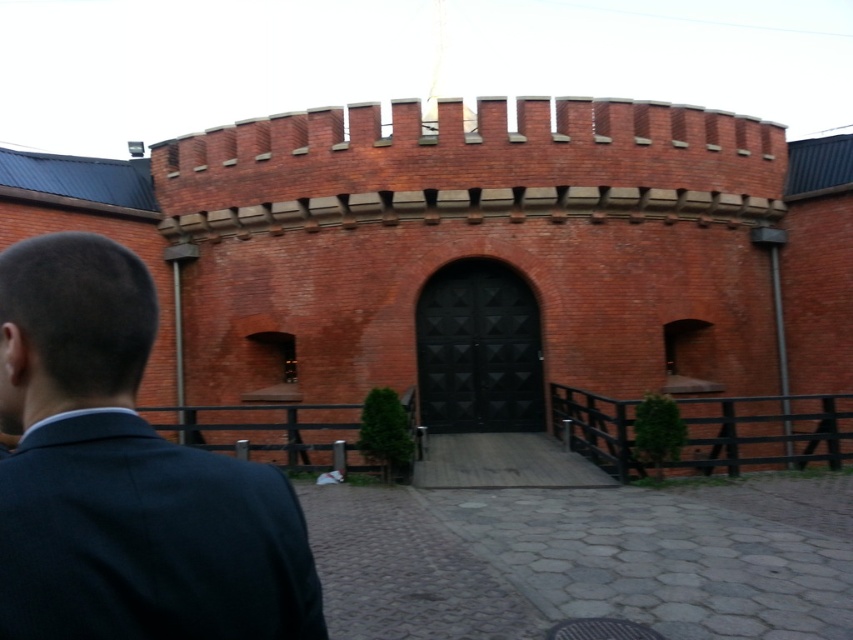
Consider the image. Is the position of red brick castle at center more distant than that of dark blue suit at left?

Yes, it is.

Does point (720, 392) lie in front of point (144, 573)?

No.

Between point (334, 273) and point (65, 486), which one is positioned behind?

Point (334, 273)

The image size is (853, 640). Find the location of `red brick castle at center`. red brick castle at center is located at coordinates (485, 269).